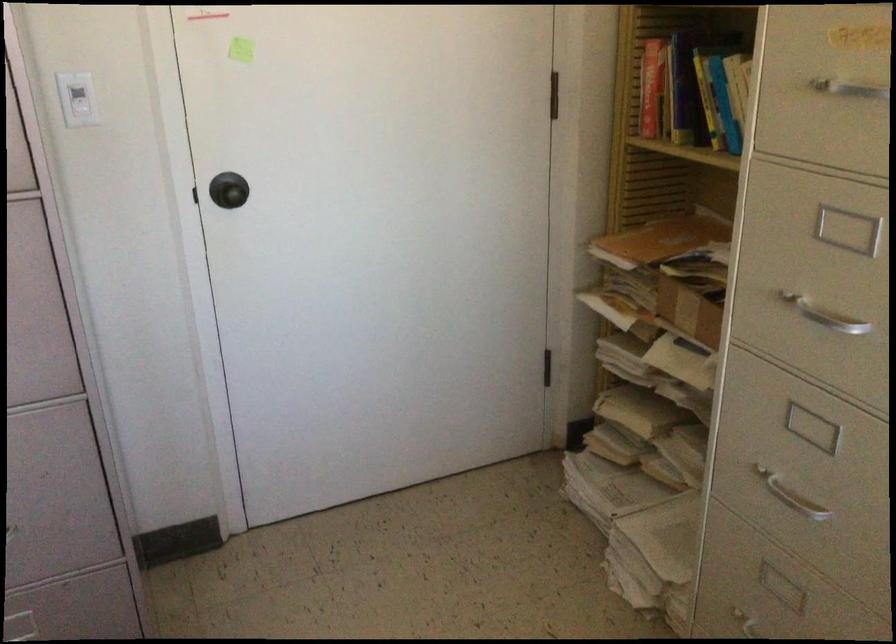
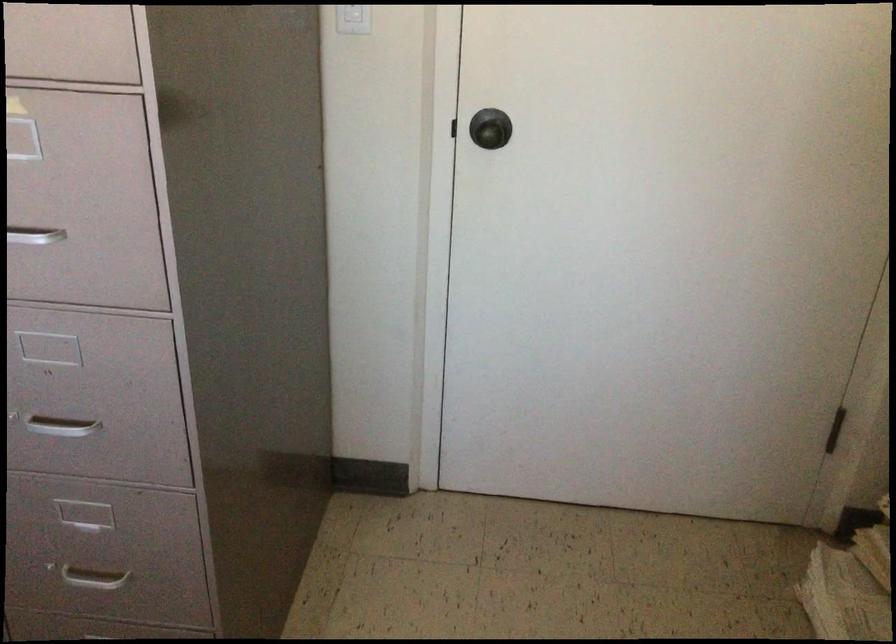
From the picture: What movement of the cameraman would produce the second image?

The movement direction of the cameraman is right, forward.